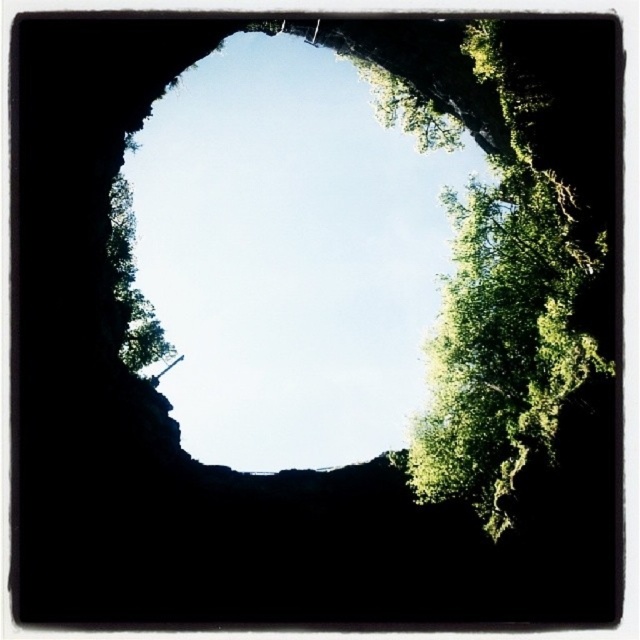
You are an explorer inside the cave and want to see the sky clearly. You notice the transparent glass hole at center and the green leafy tree at upper right. Which object allows you to see the sky better?

The transparent glass hole at center allows you to see the sky better because it is located above the green leafy tree at upper right, providing a clearer view through the cave opening.

You are standing inside the cave and looking out through the opening. You notice two green leafy trees outside. Which tree, the green leafy tree at upper right or the green leafy tree at left, appears taller in the view?

The green leafy tree at upper right appears taller than the green leafy tree at left in the view.